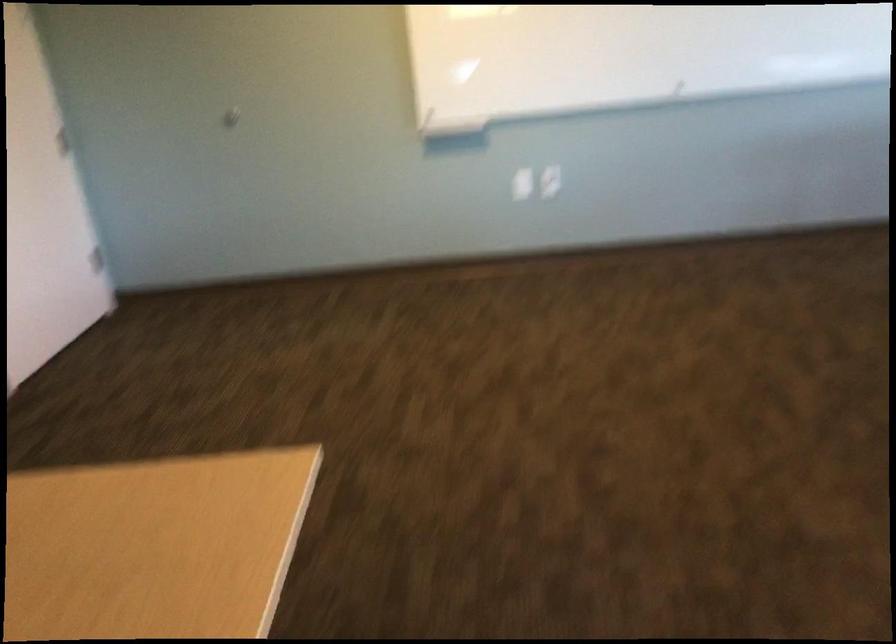
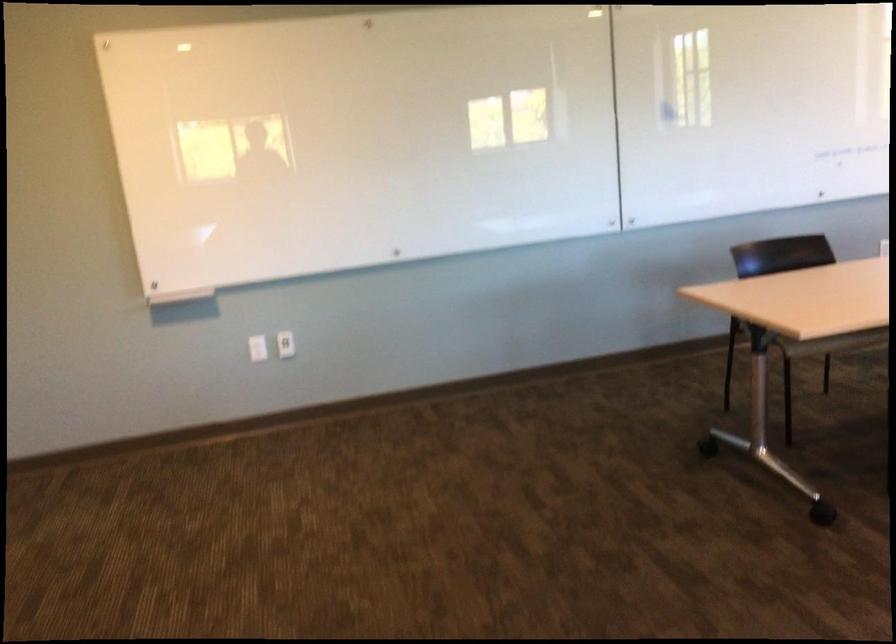
Question: The first image is from the beginning of the video and the second image is from the end. How did the camera likely rotate when shooting the video?

Choices:
 (A) Left
 (B) Right
 (C) Up
 (D) Down

Answer: (B)